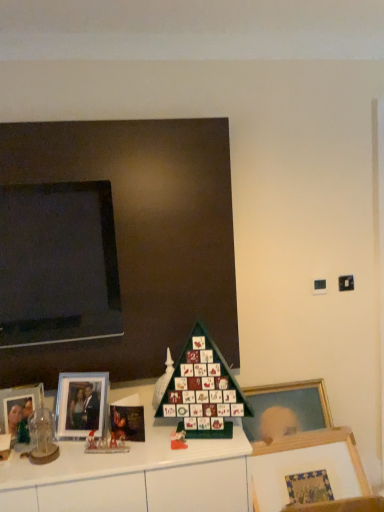
Where is `empty space that is ontop of matte black board at upper left (from a real-world perspective)`? empty space that is ontop of matte black board at upper left (from a real-world perspective) is located at coordinates (101, 119).